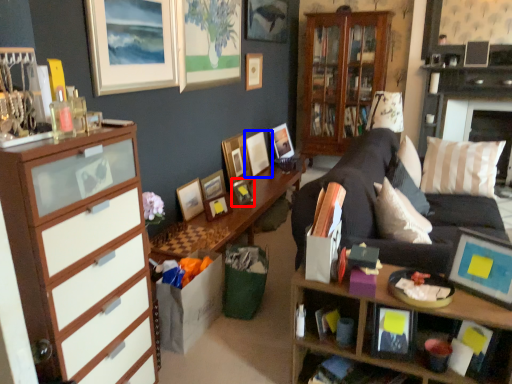
Question: Among these objects, which one is farthest to the camera, picture frame (highlighted by a red box) or picture frame (highlighted by a blue box)?

Choices:
 (A) picture frame
 (B) picture frame

Answer: (B)